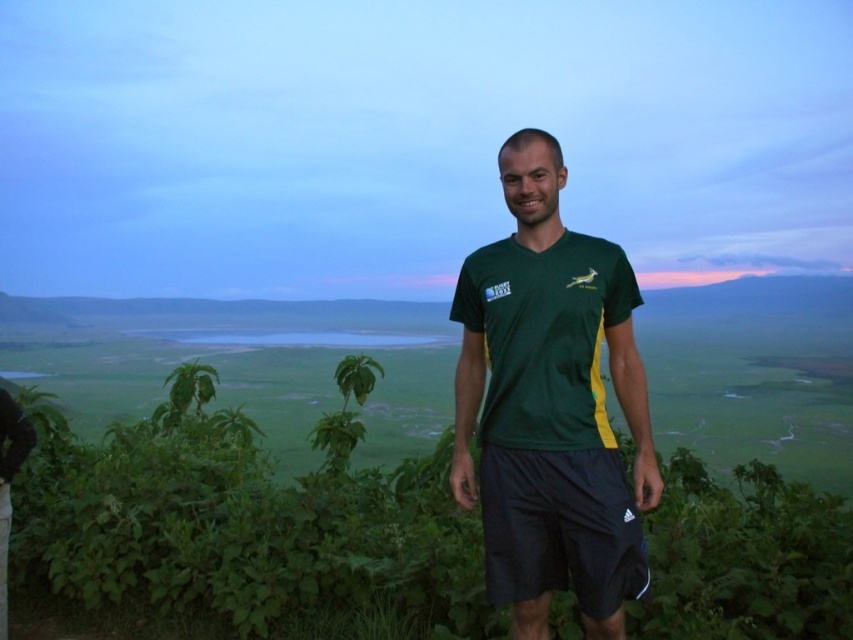
Does green leafy shrubs at center have a greater width compared to green matte shirt at center?

In fact, green leafy shrubs at center might be narrower than green matte shirt at center.

You are a GUI agent. You are given a task and a screenshot of the screen. Output one action in this format:
    pyautogui.click(x=<x>, y=<y>)
    Task: Click on the green leafy shrubs at center
    
    Given the screenshot: What is the action you would take?
    tap(242, 524)